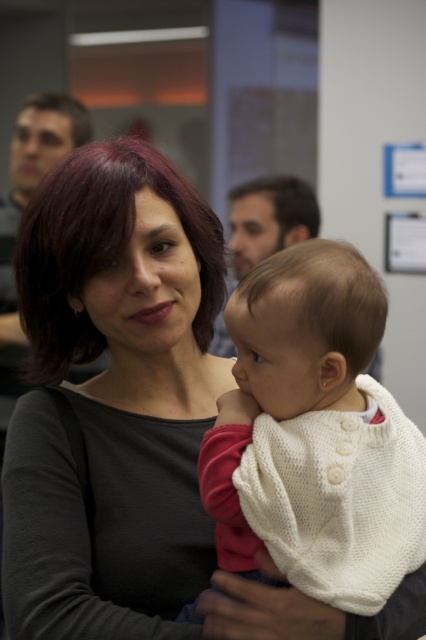
Is matte black sweater at center taller than white knitted sweater at center?

Yes, matte black sweater at center is taller than white knitted sweater at center.

Can you confirm if matte black sweater at center is thinner than white knitted sweater at center?

No, matte black sweater at center is not thinner than white knitted sweater at center.

Who is more distant from viewer, (x=72, y=272) or (x=279, y=461)?

The point (x=72, y=272) is behind.

Identify the location of matte black sweater at center. This screenshot has width=426, height=640. (114, 397).